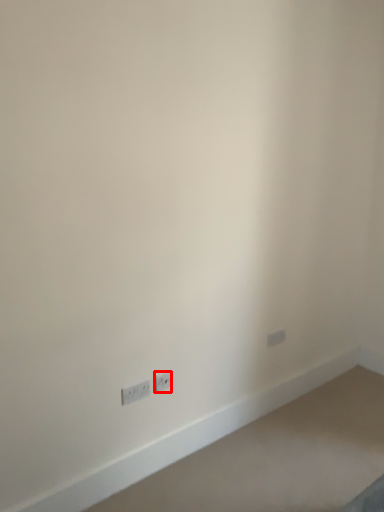
Question: From the image, what is the correct spatial relationship of power plugs and sockets (annotated by the red box) in relation to power plugs and sockets?

Choices:
 (A) left
 (B) right

Answer: (B)